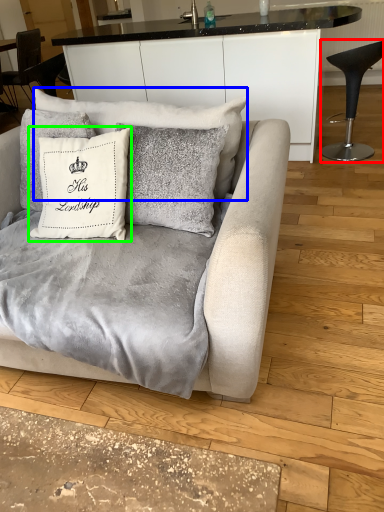
Question: Based on their relative distances, which object is farther from chair (highlighted by a red box)? Choose from pillow (highlighted by a blue box) and pillow (highlighted by a green box).

Choices:
 (A) pillow
 (B) pillow

Answer: (B)